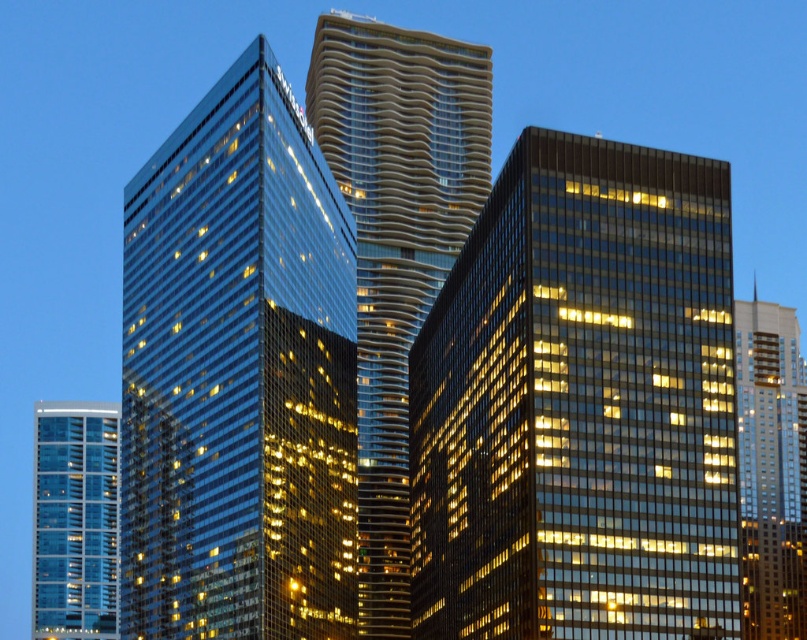
Is matte glass skyscraper at center to the left of glassy reflective tower at center from the viewer's perspective?

No, matte glass skyscraper at center is not to the left of glassy reflective tower at center.

At what (x,y) coordinates should I click in order to perform the action: click on matte glass skyscraper at center. Please return your answer as a coordinate pair (x, y). This screenshot has width=807, height=640. Looking at the image, I should click on (579, 404).

Locate an element on the screen. Image resolution: width=807 pixels, height=640 pixels. matte glass skyscraper at center is located at coordinates (579, 404).

Is matte glass skyscraper at center taller than glossy glass skyscraper at center?

No, matte glass skyscraper at center is not taller than glossy glass skyscraper at center.

Does matte glass skyscraper at center appear over glossy glass skyscraper at center?

Actually, matte glass skyscraper at center is below glossy glass skyscraper at center.

Does point (655, 212) come farther from viewer compared to point (245, 58)?

No.

You are a GUI agent. You are given a task and a screenshot of the screen. Output one action in this format:
    pyautogui.click(x=<x>, y=<y>)
    Task: Click on the matte glass skyscraper at center
    The width and height of the screenshot is (807, 640).
    Given the screenshot: What is the action you would take?
    pyautogui.click(x=579, y=404)

From the picture: Does glossy glass skyscraper at center appear under transparent glass building at lower left?

Actually, glossy glass skyscraper at center is above transparent glass building at lower left.

Is point (231, 532) positioned in front of point (53, 605)?

Yes.

Find the location of a particular element. The height and width of the screenshot is (640, 807). glossy glass skyscraper at center is located at coordinates tap(237, 376).